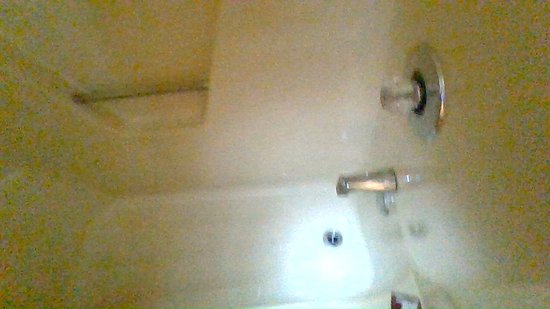
Locate an element on the screen. cut out under bar is located at coordinates (142, 121).